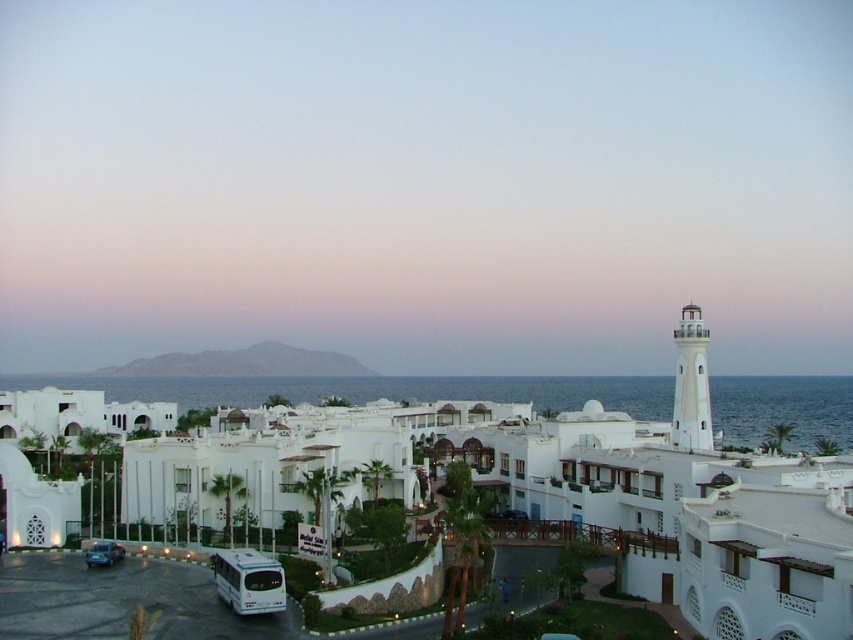
Where is `white lighthouse at right`? white lighthouse at right is located at coordinates (426, 180).

Looking at this image, can you confirm if white lighthouse at right is wider than metallic blue car at lower left?

Indeed, white lighthouse at right has a greater width compared to metallic blue car at lower left.

Is point (86, 250) positioned in front of point (111, 561)?

No, it is behind (111, 561).

At what (x,y) coordinates should I click in order to perform the action: click on white lighthouse at right. Please return your answer as a coordinate pair (x, y). This screenshot has height=640, width=853. Looking at the image, I should click on (426, 180).